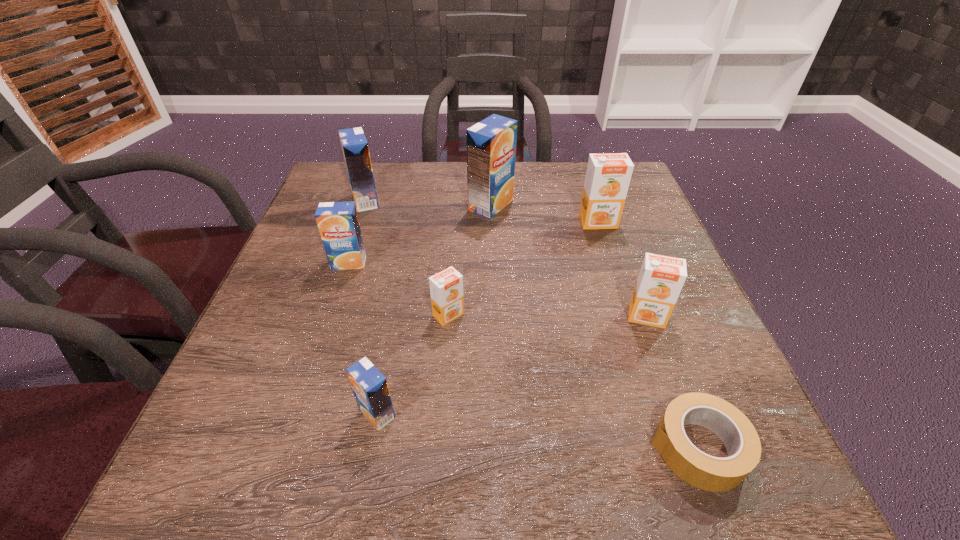
At what (x,y) coordinates should I click in order to perform the action: click on empty space between the shortest object and the fourth farthest object. Please return your answer as a coordinate pair (x, y). The width and height of the screenshot is (960, 540). Looking at the image, I should click on (523, 355).

Identify which object is the sixth closest to the leftmost orange orange juice. Please provide its 2D coordinates. Your answer should be formatted as a tuple, i.e. [(x, y)], where the tuple contains the x and y coordinates of a point satisfying the conditions above.

[(354, 145)]

Locate which object is the second closest to the shortest object. Please provide its 2D coordinates. Your answer should be formatted as a tuple, i.e. [(x, y)], where the tuple contains the x and y coordinates of a point satisfying the conditions above.

[(446, 287)]

Identify the location of the sixth closest orange juice relative to the fourth orange juice from left to right. (608, 175).

Where is `the fourth closest orange juice to the fourth orange juice from left to right`? The height and width of the screenshot is (540, 960). the fourth closest orange juice to the fourth orange juice from left to right is located at coordinates (661, 278).

The width and height of the screenshot is (960, 540). I want to click on blue orange_juice that stands as the third closest to the third smallest blue orange_juice, so click(x=370, y=388).

Locate which blue orange_juice ranks in proximity to the smallest blue orange_juice. Please provide its 2D coordinates. Your answer should be formatted as a tuple, i.e. [(x, y)], where the tuple contains the x and y coordinates of a point satisfying the conditions above.

[(338, 224)]

You are a GUI agent. You are given a task and a screenshot of the screen. Output one action in this format:
    pyautogui.click(x=<x>, y=<y>)
    Task: Click on the closest orange orange juice to the second biggest orange orange juice
    
    Given the screenshot: What is the action you would take?
    pyautogui.click(x=608, y=175)

Identify the location of orange orange juice that can be found as the second closest to the shortest object. The image size is (960, 540). (446, 287).

Locate an element on the screen. This screenshot has width=960, height=540. vacant position in the image that satisfies the following two spatial constraints: 1. on the front side of the fourth orange juice from left to right; 2. on the right side of the fourth nearest orange juice is located at coordinates (331, 315).